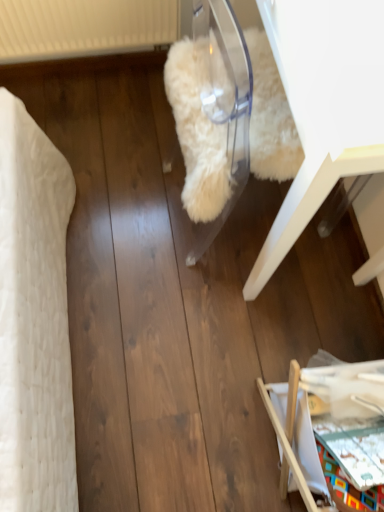
You are a GUI agent. You are given a task and a screenshot of the screen. Output one action in this format:
    pyautogui.click(x=<x>, y=<y>)
    Task: Click on the free space in front of white fluffy rug at center, acting as the first furniture starting from the top
    
    Given the screenshot: What is the action you would take?
    pyautogui.click(x=224, y=346)